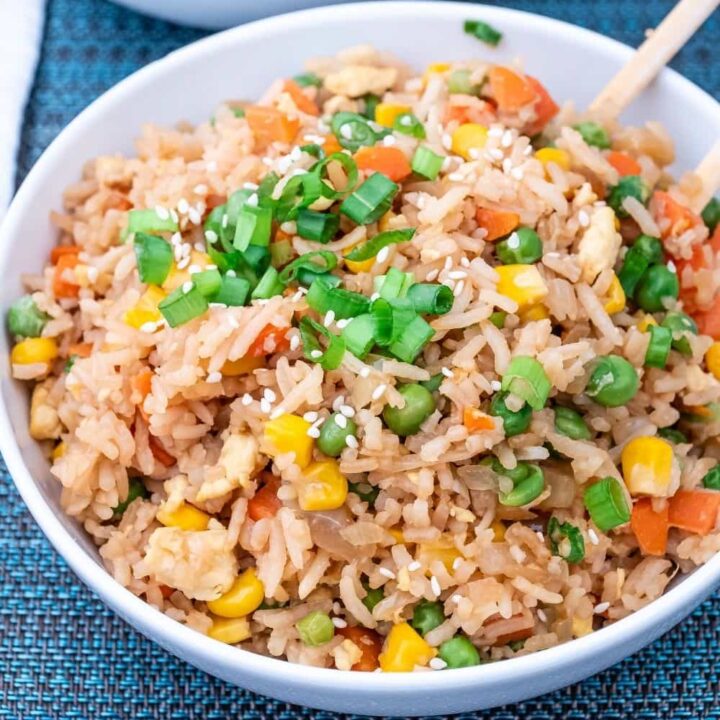
Locate an element on the screen. portion of bowl in background is located at coordinates (216, 16).